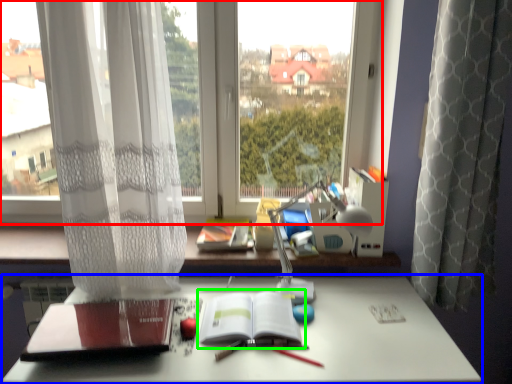
Question: Which is farther away from window (highlighted by a red box)? desk (highlighted by a blue box) or paperback book (highlighted by a green box)?

Choices:
 (A) desk
 (B) paperback book

Answer: (A)